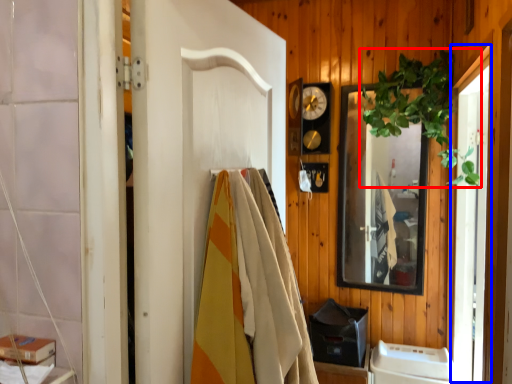
Question: Which of the following is the farthest to the observer, plant (highlighted by a red box) or screen door (highlighted by a blue box)?

Choices:
 (A) plant
 (B) screen door

Answer: (A)